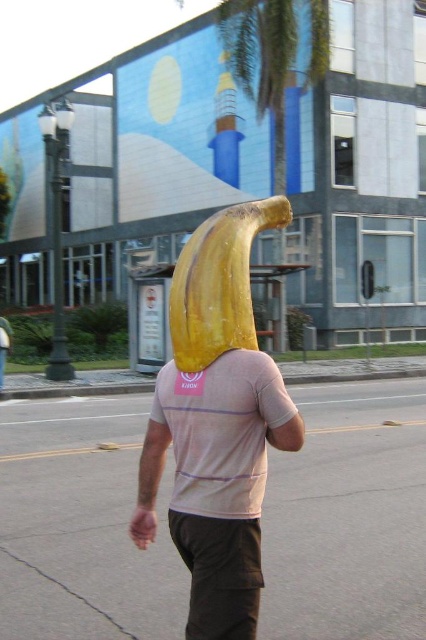
Which is more to the right, yellow rubber banana at center or yellow matte banana at center?

Positioned to the right is yellow rubber banana at center.

Consider the image. Is yellow rubber banana at center taller than yellow matte banana at center?

No.

Who is more distant from viewer, (238, 588) or (206, 266)?

The point (206, 266) is more distant.

This screenshot has height=640, width=426. I want to click on yellow rubber banana at center, so click(216, 422).